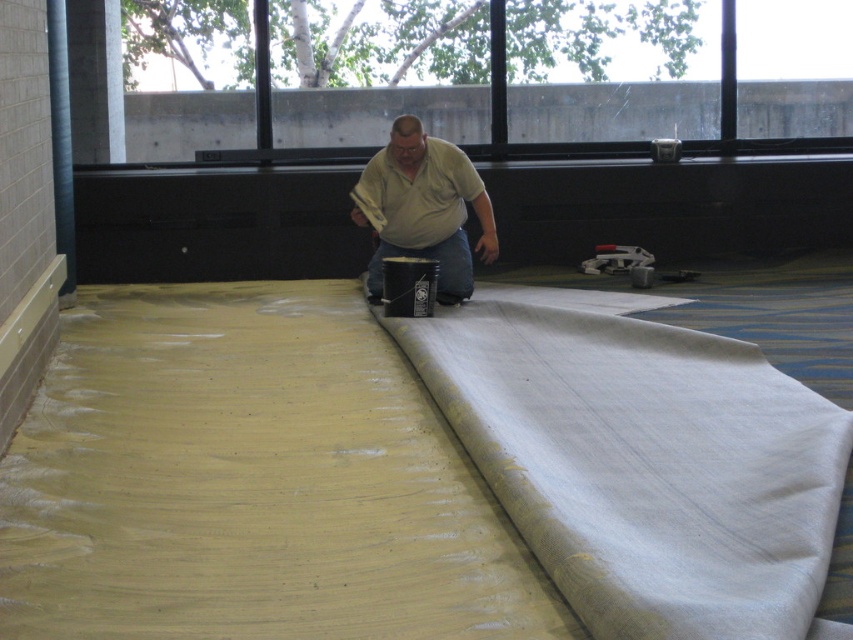
You are a contractor working on a floor renovation. You see a white fabric at center and a matte beige shirt at center. Which object is located to the right of the other?

The white fabric at center is positioned on the right side of matte beige shirt at center.

You are a contractor working on a floor renovation. You need to place a tool on the floor where it won t be in the way. The tool is too heavy to lift, so you can only slide it horizontally. The white fabric at center and the matte beige shirt at center are in your way. Which object should you move to make space?

You should move the white fabric at center because it is located below the matte beige shirt at center, so sliding the tool horizontally towards the white fabric at center would require moving the shirt first, but since the fabric is lower, it might be easier to slide around it.

You are a contractor assessing the workspace. You see the white fabric at center and the matte beige shirt at center. Which object is wider?

The white fabric at center is wider than the matte beige shirt at center.